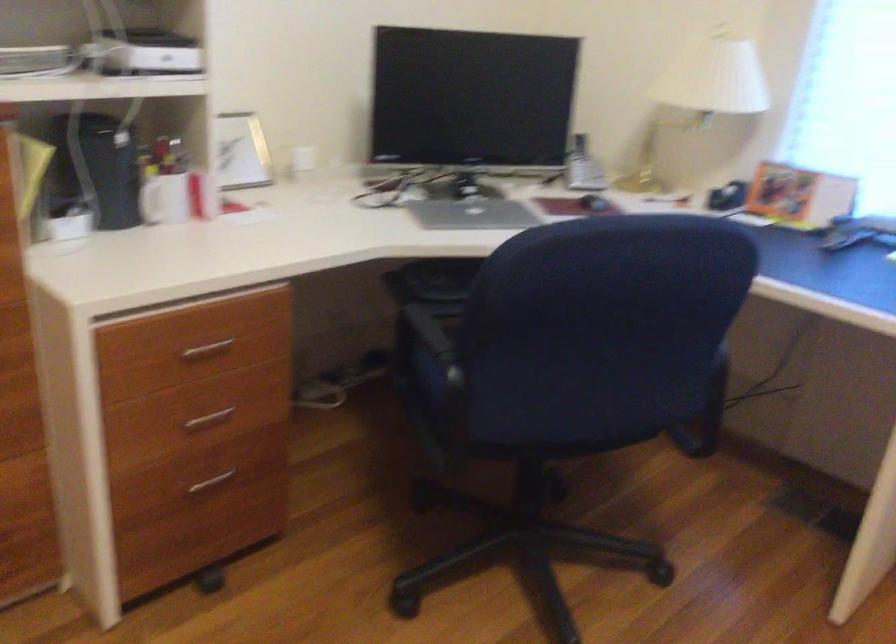
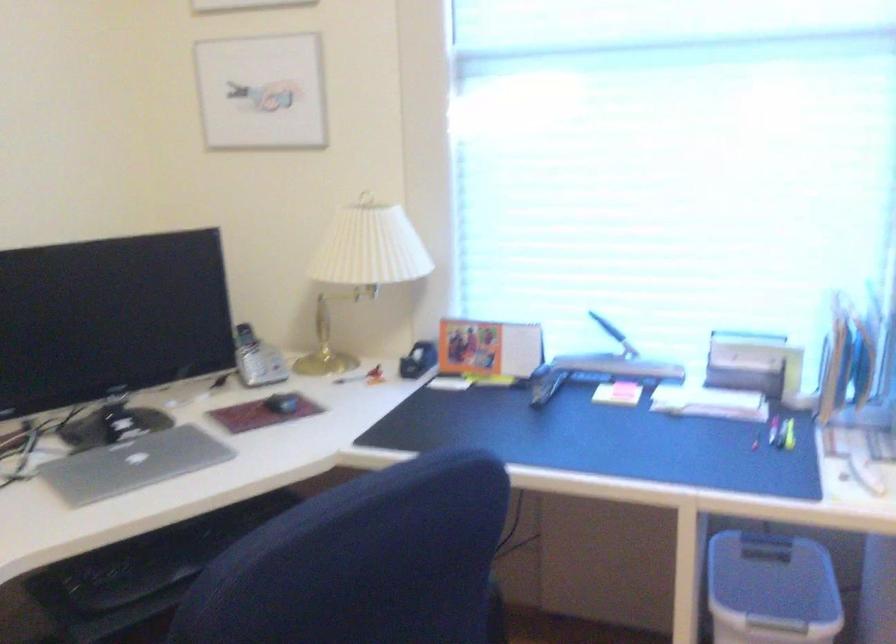
Question: Based on the continuous images, in which direction is the camera rotating? Reply with the corresponding letter.

Choices:
 (A) Left
 (B) Right
 (C) Up
 (D) Down

Answer: (B)